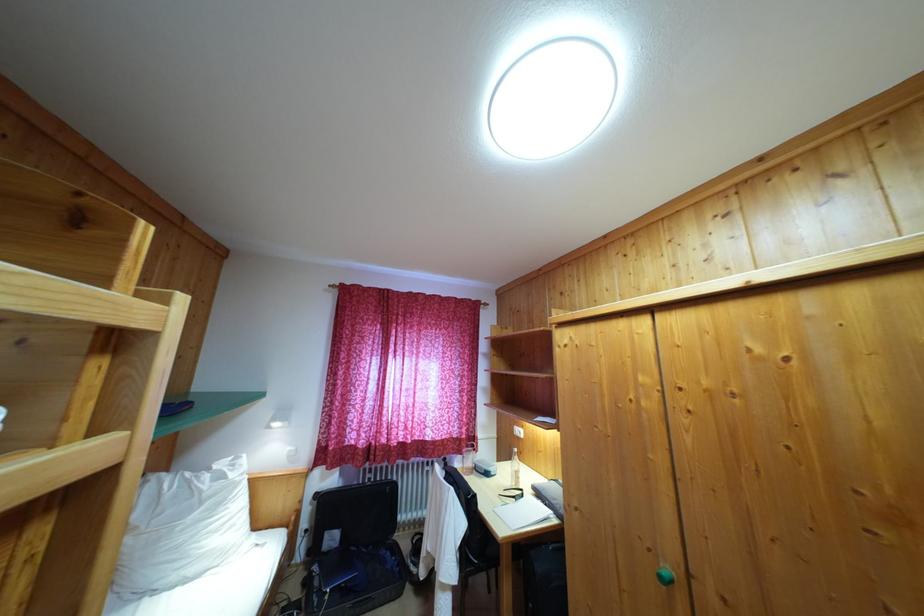
Identify the location of green cabinet knob. The height and width of the screenshot is (616, 924). (664, 576).